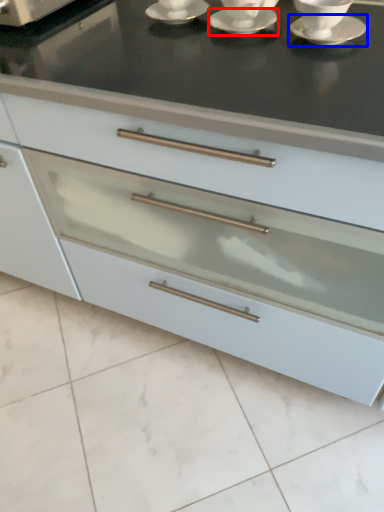
Question: Which object appears farthest to the camera in this image, saucer (highlighted by a red box) or saucer (highlighted by a blue box)?

Choices:
 (A) saucer
 (B) saucer

Answer: (A)